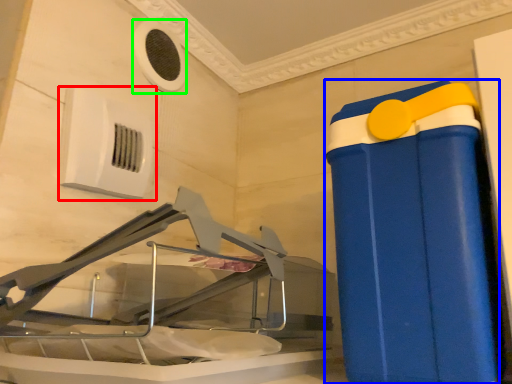
Question: Which object is the farthest from air conditioning (highlighted by a red box)? Choose among these: waste container (highlighted by a blue box) or air conditioning (highlighted by a green box).

Choices:
 (A) waste container
 (B) air conditioning

Answer: (A)